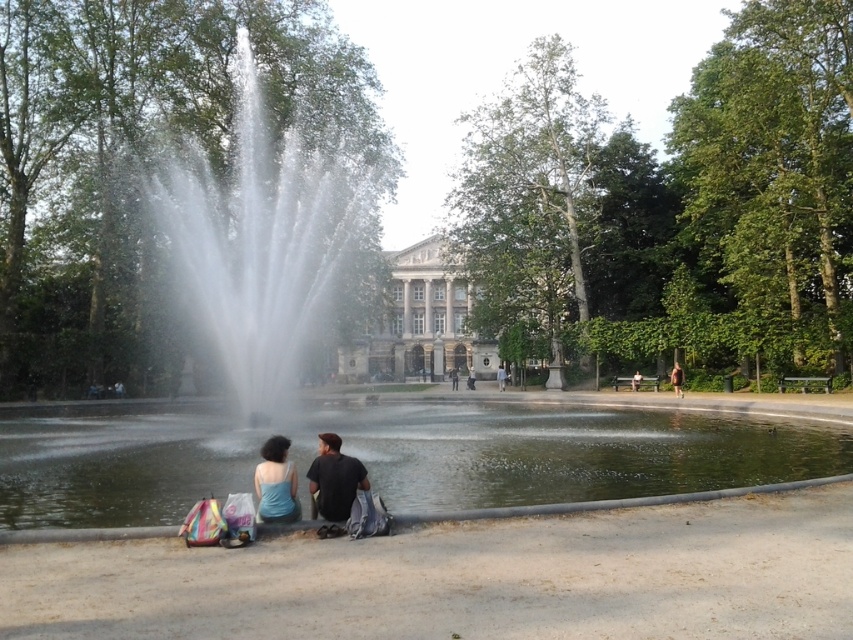
You are a photographer trying to capture the clear water fountain at center and the light blue fabric jacket at center in a single shot. Based on their sizes, which object should you focus on first to ensure both are in frame?

The clear water fountain at center is taller than the light blue fabric jacket at center, so you should focus on the clear water fountain at center first to ensure both are in frame.